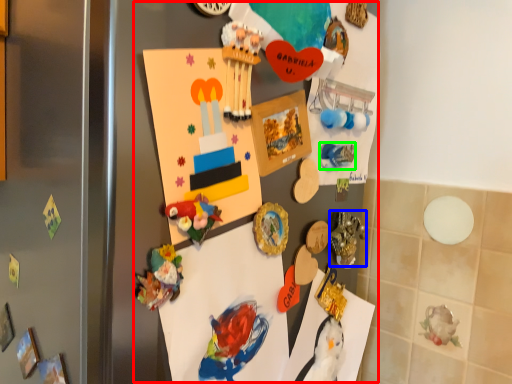
Question: Considering the real-world distances, which object is farthest from collection (highlighted by a red box)? art (highlighted by a blue box) or art (highlighted by a green box)?

Choices:
 (A) art
 (B) art

Answer: (B)